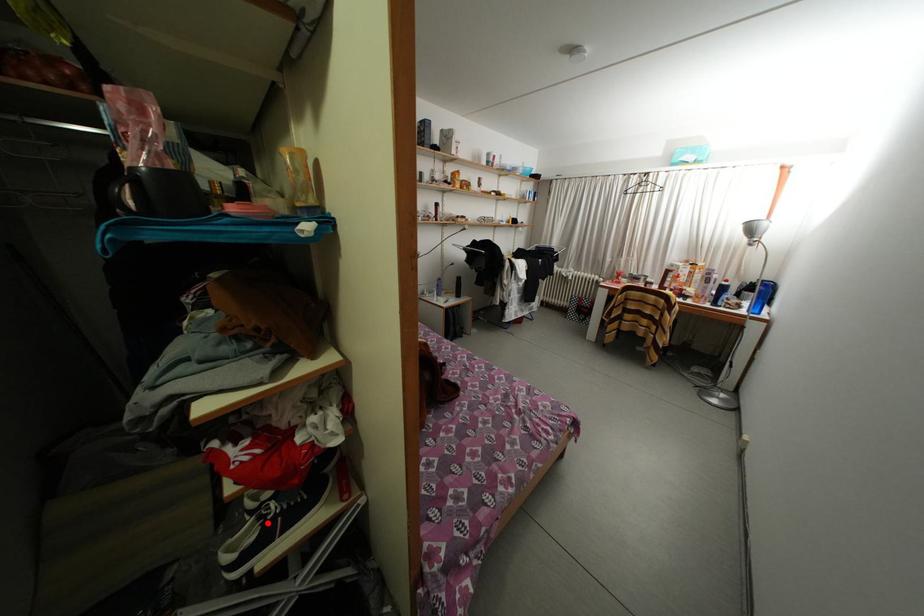
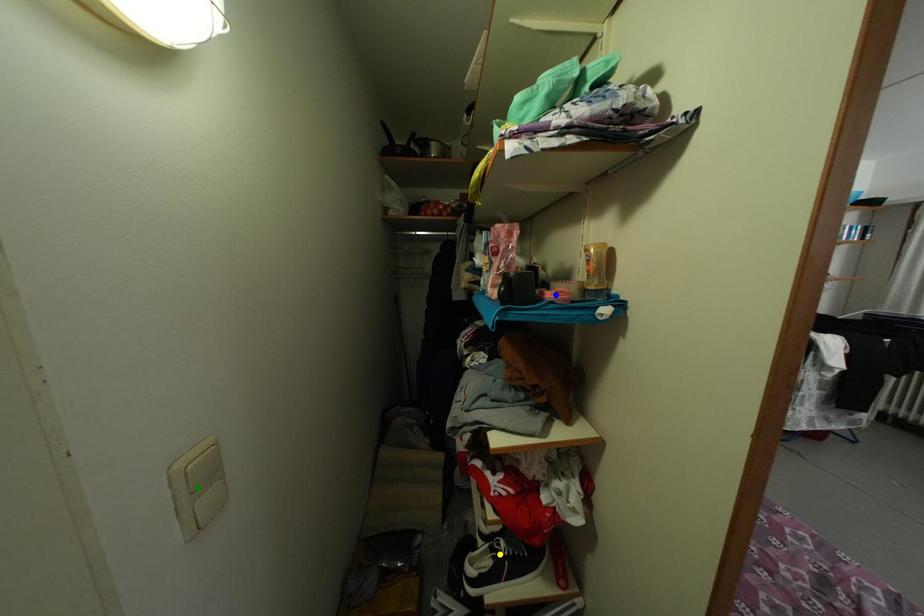
Question: I am providing you with two images of the same scene from different viewpoints. A red point is marked on the first image. You are given multiple points on the second image. Can you choose the point in image 2 that corresponds to the point in image 1?

Choices:
 (A) yellow point
 (B) blue point
 (C) green point

Answer: (A)